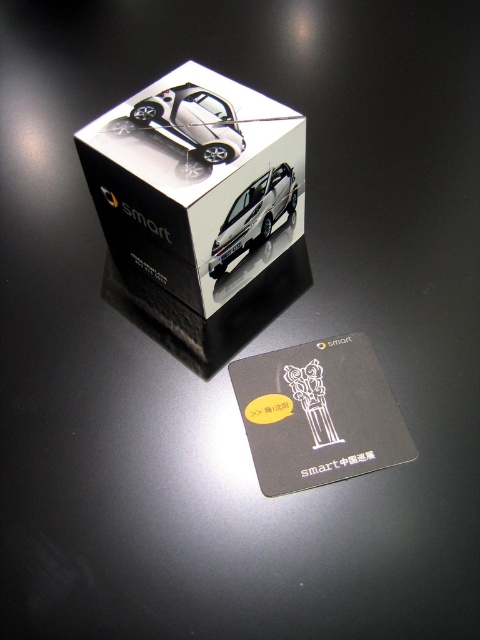
Looking at this image, between white glossy car at center and satin silver metallic car at center, which one appears on the right side from the viewer's perspective?

From the viewer's perspective, satin silver metallic car at center appears more on the right side.

Is the position of white glossy car at center less distant than that of satin silver metallic car at center?

That is True.

Locate an element on the screen. This screenshot has height=640, width=480. white glossy car at center is located at coordinates (196, 182).

Identify the location of white glossy car at center. The height and width of the screenshot is (640, 480). (196, 182).

Between point (276, 356) and point (284, 184), which one is positioned behind?

The point (276, 356) is more distant.

Between black matte business card at lower center and satin silver metallic car at center, which one appears on the right side from the viewer's perspective?

black matte business card at lower center is more to the right.

Does point (243, 364) come in front of point (224, 248)?

No, (243, 364) is behind (224, 248).

This screenshot has width=480, height=640. What are the coordinates of `black matte business card at lower center` in the screenshot? It's located at (319, 413).

Describe the element at coordinates (194, 120) in the screenshot. I see `satin silver car at center` at that location.

Which is in front, point (175, 109) or point (268, 200)?

Positioned in front is point (175, 109).

Does point (203, 116) come in front of point (276, 188)?

Yes, it is in front of point (276, 188).

Locate an element on the screen. satin silver car at center is located at coordinates (194, 120).